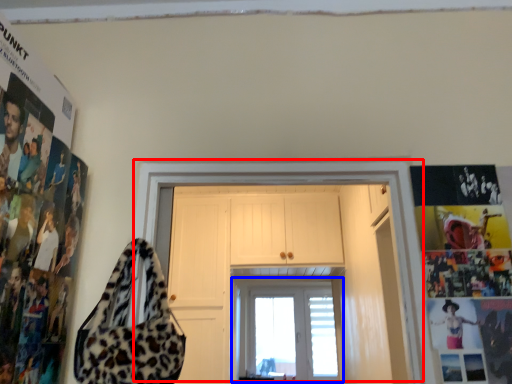
Question: Which object is further to the camera taking this photo, door (highlighted by a red box) or window (highlighted by a blue box)?

Choices:
 (A) door
 (B) window

Answer: (B)